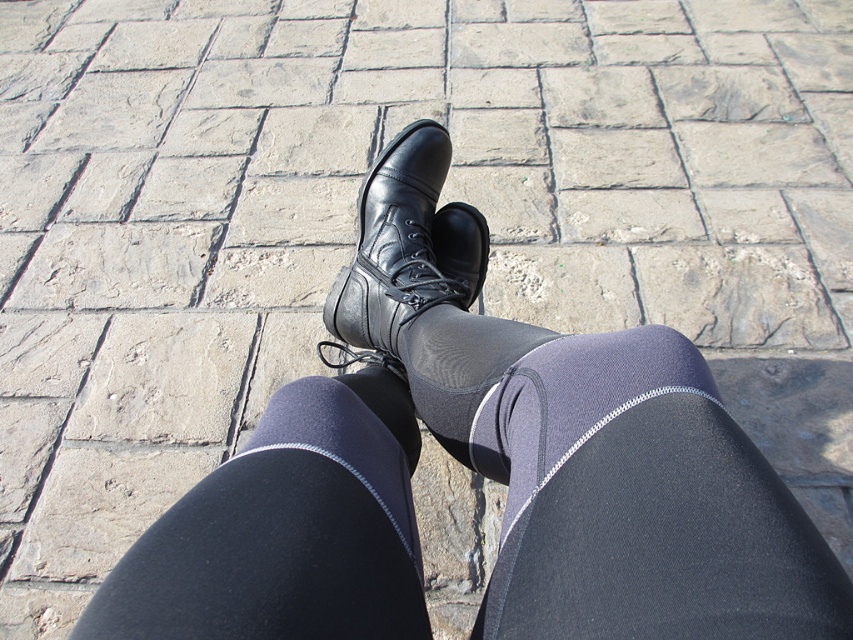
Who is taller, matte black leggings at center or black matte sock at center?

Standing taller between the two is matte black leggings at center.

Can you confirm if matte black leggings at center is taller than black matte sock at center?

Indeed, matte black leggings at center has a greater height compared to black matte sock at center.

At what (x,y) coordinates should I click in order to perform the action: click on matte black leggings at center. Please return your answer as a coordinate pair (x, y). The height and width of the screenshot is (640, 853). Looking at the image, I should click on (640, 502).

Who is higher up, black leather shoe at center or black matte sock at center?

black leather shoe at center is above.

This screenshot has height=640, width=853. Identify the location of black leather shoe at center. (404, 250).

Between point (415, 280) and point (267, 428), which one is positioned in front?

Positioned in front is point (267, 428).

I want to click on black leather shoe at center, so click(x=404, y=250).

Can you confirm if matte black leggings at center is shorter than black leather shoe at center?

Correct, matte black leggings at center is not as tall as black leather shoe at center.

Can you confirm if matte black leggings at center is positioned to the right of black leather shoe at center?

Correct, you'll find matte black leggings at center to the right of black leather shoe at center.

The height and width of the screenshot is (640, 853). Describe the element at coordinates (640, 502) in the screenshot. I see `matte black leggings at center` at that location.

Where is `matte black leggings at center`? matte black leggings at center is located at coordinates (640, 502).